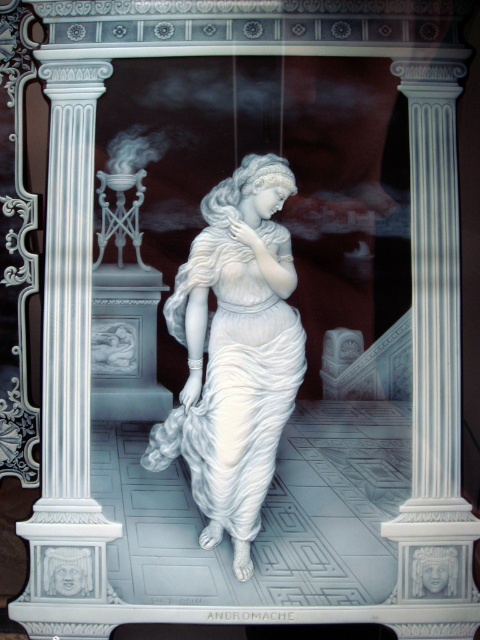
You are an art conservator examining the sculpture. You notice the white glossy dress at center and the white marble column at left. Which object is closer to the viewer?

The white marble column at left is closer to the viewer than the white glossy dress at center because the dress is positioned behind the column.

You are an interior designer planning to place a new sculpture in a room with the existing white marble column at left and white glossy dress at center. Which object has a smaller diameter or width?

The white marble column at left is thinner than the white glossy dress at center, so the column has a smaller diameter or width.